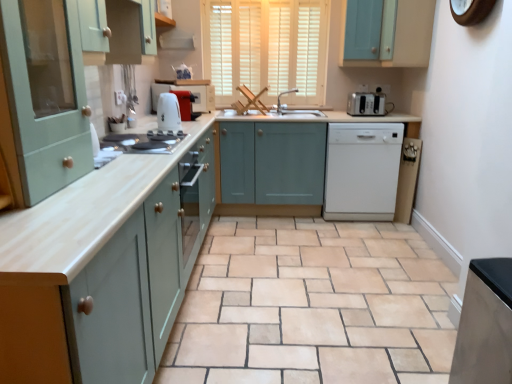
What do you see at coordinates (186, 104) in the screenshot? I see `matte red coffee machine at center` at bounding box center [186, 104].

Identify the location of teal wood cabinet at upper right, arranged as the first cabinetry when viewed from the right. (386, 33).

Image resolution: width=512 pixels, height=384 pixels. Identify the location of matte teal cabinet at center, positioned as the second cabinetry in right-to-left order. (272, 162).

Identify the location of matte silver faucet at center. (283, 94).

You are a GUI agent. You are given a task and a screenshot of the screen. Output one action in this format:
    pyautogui.click(x=<x>, y=<y>)
    Task: Click on the white glossy exhaust hood at upper center
    This screenshot has height=384, width=512.
    Given the screenshot: What is the action you would take?
    pyautogui.click(x=177, y=40)

The image size is (512, 384). I want to click on matte red coffee machine at center, so click(x=186, y=104).

Is matte green cabinet at left, which appears as the third cabinetry when viewed from the right, next to white glossy exhaust hood at upper center and touching it?

No, matte green cabinet at left, which appears as the third cabinetry when viewed from the right, is not next to white glossy exhaust hood at upper center.

From the image's perspective, which object appears higher, matte green cabinet at left, acting as the 2th cabinetry starting from the left, or white glossy exhaust hood at upper center?

white glossy exhaust hood at upper center is shown above in the image.

Between matte green cabinet at left, acting as the 2th cabinetry starting from the left, and white glossy exhaust hood at upper center, which one has larger size?

matte green cabinet at left, acting as the 2th cabinetry starting from the left.

Is matte green cabinet at left, which appears as the third cabinetry when viewed from the right, to the left of white glossy exhaust hood at upper center from the viewer's perspective?

Yes.

Considering the relative sizes of white glossy exhaust hood at upper center and matte red coffee machine at center in the image provided, is white glossy exhaust hood at upper center wider than matte red coffee machine at center?

In fact, white glossy exhaust hood at upper center might be narrower than matte red coffee machine at center.

Is point (161, 39) closer to camera compared to point (185, 113)?

No, it is not.

Considering the positions of objects white glossy exhaust hood at upper center and matte red coffee machine at center in the image provided, who is more to the right, white glossy exhaust hood at upper center or matte red coffee machine at center?

matte red coffee machine at center.

Is white glossy exhaust hood at upper center touching matte red coffee machine at center?

There is a gap between white glossy exhaust hood at upper center and matte red coffee machine at center.

From a real-world perspective, which is physically above, white glossy exhaust hood at upper center or matte green cabinet at left, acting as the 2th cabinetry starting from the left?

white glossy exhaust hood at upper center, from a real-world perspective.

From their relative heights in the image, would you say white glossy exhaust hood at upper center is taller or shorter than matte green cabinet at left, acting as the 2th cabinetry starting from the left?

Considering their sizes, white glossy exhaust hood at upper center has less height than matte green cabinet at left, acting as the 2th cabinetry starting from the left.

Can you confirm if white glossy exhaust hood at upper center is thinner than matte green cabinet at left, acting as the 2th cabinetry starting from the left?

Indeed, white glossy exhaust hood at upper center has a lesser width compared to matte green cabinet at left, acting as the 2th cabinetry starting from the left.

Considering the positions of objects white glossy exhaust hood at upper center and matte green cabinet at left, acting as the 2th cabinetry starting from the left, in the image provided, who is behind, white glossy exhaust hood at upper center or matte green cabinet at left, acting as the 2th cabinetry starting from the left,?

Positioned behind is white glossy exhaust hood at upper center.

Which is nearer, (339, 203) or (376, 12)?

Point (339, 203) appears to be farther away from the viewer than point (376, 12).

Considering the positions of objects white matte dishwasher at center, marked as the second home appliance in a front-to-back arrangement, and teal wood cabinet at upper right, arranged as the first cabinetry when viewed from the right, in the image provided, who is more to the left, white matte dishwasher at center, marked as the second home appliance in a front-to-back arrangement, or teal wood cabinet at upper right, arranged as the first cabinetry when viewed from the right,?

From the viewer's perspective, white matte dishwasher at center, marked as the second home appliance in a front-to-back arrangement, appears more on the left side.

Is white matte dishwasher at center, the 3th home appliance when ordered from left to right, surrounding teal wood cabinet at upper right, the 4th cabinetry positioned from the left?

Actually, teal wood cabinet at upper right, the 4th cabinetry positioned from the left, is outside white matte dishwasher at center, the 3th home appliance when ordered from left to right.

From the image's perspective, is white matte dishwasher at center, marked as the second home appliance in a front-to-back arrangement, located beneath teal wood cabinet at upper right, arranged as the first cabinetry when viewed from the right?

Yes, from the image's perspective, white matte dishwasher at center, marked as the second home appliance in a front-to-back arrangement, is below teal wood cabinet at upper right, arranged as the first cabinetry when viewed from the right.

Choose the correct answer: Is white glossy kettle at center inside matte wood countertop at center or outside it?

white glossy kettle at center lies outside matte wood countertop at center.

Considering the positions of objects white glossy kettle at center and matte wood countertop at center in the image provided, who is in front, white glossy kettle at center or matte wood countertop at center?

matte wood countertop at center is closer to the camera.

Can you tell me how much white glossy kettle at center and matte wood countertop at center differ in facing direction?

7.85 degrees.

Where is `countertop in front of the white glossy kettle at center`? The height and width of the screenshot is (384, 512). countertop in front of the white glossy kettle at center is located at coordinates click(84, 214).

From the image's perspective, would you say satin silver fridge at lower right, which is counted as the fourth home appliance, starting from the back, is shown under matte teal cabinet at center, the 3th cabinetry when ordered from left to right?

Yes, from the image's perspective, satin silver fridge at lower right, which is counted as the fourth home appliance, starting from the back, is beneath matte teal cabinet at center, the 3th cabinetry when ordered from left to right.

Is satin silver fridge at lower right, the 1th home appliance when ordered from front to back, to the left of matte teal cabinet at center, positioned as the second cabinetry in right-to-left order, from the viewer's perspective?

Incorrect, satin silver fridge at lower right, the 1th home appliance when ordered from front to back, is not on the left side of matte teal cabinet at center, positioned as the second cabinetry in right-to-left order.

Between satin silver fridge at lower right, acting as the 2th home appliance starting from the left, and matte teal cabinet at center, the 3th cabinetry when ordered from left to right, which one has larger size?

With larger size is matte teal cabinet at center, the 3th cabinetry when ordered from left to right.

Is matte silver faucet at center positioned with its back to matte red coffee machine at center?

No, matte silver faucet at center is not facing away from matte red coffee machine at center.

Which of these two, matte silver faucet at center or matte red coffee machine at center, is smaller?

Smaller between the two is matte red coffee machine at center.

From a real-world perspective, between matte silver faucet at center and matte red coffee machine at center, who is vertically higher?

From a 3D spatial view, matte silver faucet at center is above.

Does matte silver faucet at center have a lesser height compared to matte red coffee machine at center?

Indeed, matte silver faucet at center has a lesser height compared to matte red coffee machine at center.

I want to click on exhaust hood behind the matte green cabinet at left, acting as the 2th cabinetry starting from the left, so click(x=177, y=40).

You are a GUI agent. You are given a task and a screenshot of the screen. Output one action in this format:
    pyautogui.click(x=<x>, y=<y>)
    Task: Click on the exhaust hood on the left of matte red coffee machine at center
    
    Given the screenshot: What is the action you would take?
    pyautogui.click(x=177, y=40)

Consider the image. Considering their positions, is matte wood countertop at center positioned closer to matte white gas stove at center than satin silver fridge at lower right, the 1th home appliance when ordered from front to back?

matte wood countertop at center is positioned closer to the anchor matte white gas stove at center.

From the image, which object appears to be nearer to white glossy exhaust hood at upper center, matte red coffee machine at center or teal wood cabinet at upper right, the 4th cabinetry positioned from the left?

Based on the image, matte red coffee machine at center appears to be nearer to white glossy exhaust hood at upper center.

From the image, which object appears to be nearer to beige ceramic tile at center, matte red coffee machine at center or satin silver fridge at lower right, which is counted as the fourth home appliance, starting from the back?

Among the two, satin silver fridge at lower right, which is counted as the fourth home appliance, starting from the back, is located nearer to beige ceramic tile at center.

Considering their positions, is matte teal cabinet at center, the 3th cabinetry when ordered from left to right, positioned further to matte white gas stove at center than white glossy exhaust hood at upper center?

Based on the image, white glossy exhaust hood at upper center appears to be further to matte white gas stove at center.

Considering their positions, is matte green cabinet at left, acting as the 2th cabinetry starting from the left, positioned closer to matte silver faucet at center than matte teal cabinet at center, positioned as the second cabinetry in right-to-left order?

Based on the image, matte teal cabinet at center, positioned as the second cabinetry in right-to-left order, appears to be nearer to matte silver faucet at center.

Considering their positions, is white wood blinds at upper center positioned closer to matte wood countertop at center than matte white gas stove at center?

matte white gas stove at center is closer to matte wood countertop at center.

Which object lies nearer to the anchor point white glossy kettle at center, satin silver fridge at lower right, acting as the 2th home appliance starting from the left, or matte wood countertop at center?

matte wood countertop at center is positioned closer to the anchor white glossy kettle at center.

Which object lies nearer to the anchor point matte green cabinet at left, acting as the 2th cabinetry starting from the left, white plastic toaster at right, which appears as the fourth home appliance when viewed from the front, or white glossy kettle at center?

Based on the image, white glossy kettle at center appears to be nearer to matte green cabinet at left, acting as the 2th cabinetry starting from the left.

You are a GUI agent. You are given a task and a screenshot of the screen. Output one action in this format:
    pyautogui.click(x=<x>, y=<y>)
    Task: Click on the ceramic tile positioned between satin silver fridge at lower right, the 1th home appliance when ordered from front to back, and white matte dishwasher at center, marked as the second home appliance in a front-to-back arrangement, from near to far
    
    Given the screenshot: What is the action you would take?
    pyautogui.click(x=312, y=306)

The image size is (512, 384). What are the coordinates of `coffee machine between white glossy kettle at center and white matte dishwasher at center, marked as the second home appliance in a front-to-back arrangement, from left to right` in the screenshot? It's located at (186, 104).

The height and width of the screenshot is (384, 512). I want to click on kitchen appliance between matte white gas stove at center and white glossy exhaust hood at upper center along the z-axis, so click(168, 112).

Find the location of a particular element. The image size is (512, 384). window between white glossy exhaust hood at upper center and matte silver faucet at center in the horizontal direction is located at coordinates (266, 48).